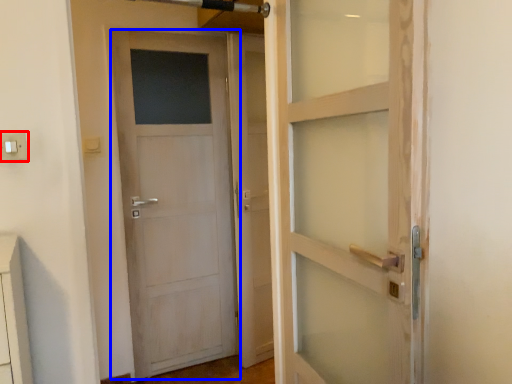
Question: Among these objects, which one is nearest to the camera, electric outlet (highlighted by a red box) or door (highlighted by a blue box)?

Choices:
 (A) electric outlet
 (B) door

Answer: (A)